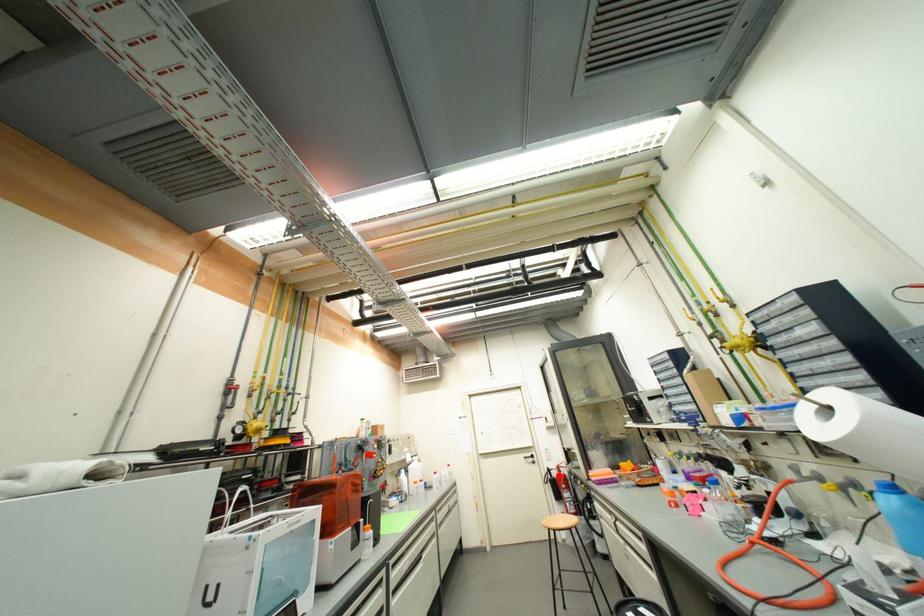
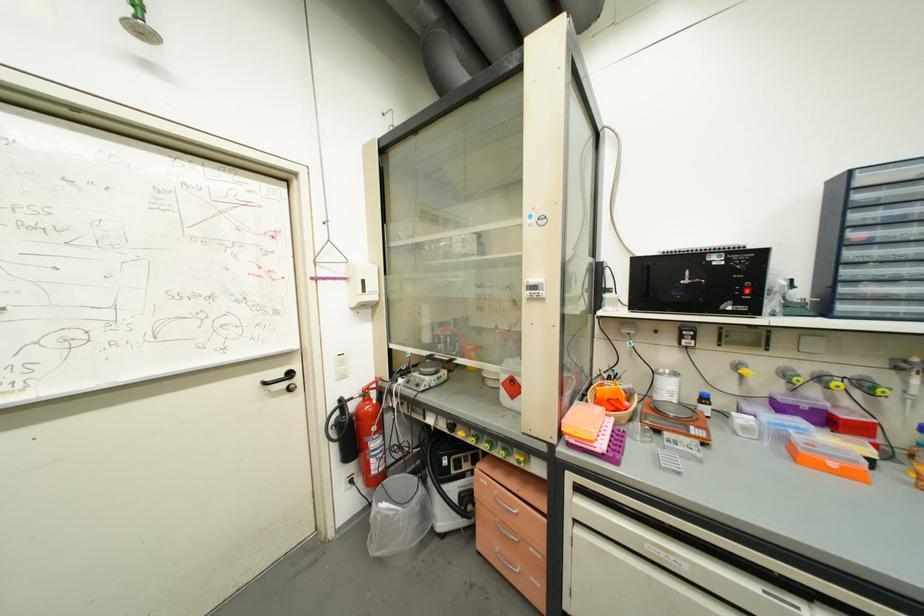
Question: I am providing you with two images of the same scene from different viewpoints. A red point is shown in image1. For the corresponding object point in image2, is it positioned nearer or farther from the camera?

Choices:
 (A) Nearer
 (B) Farther

Answer: (A)